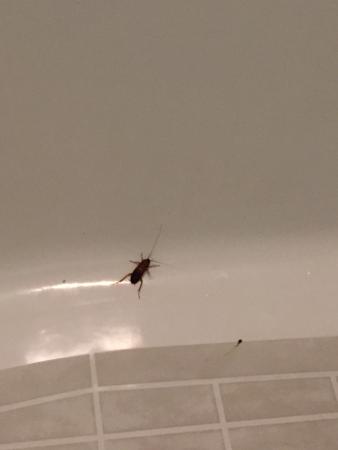
Where is `tile`? The height and width of the screenshot is (450, 338). tile is located at coordinates (266, 372).